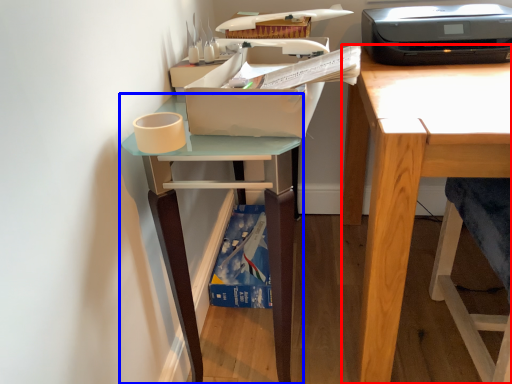
Question: Which of the following is the farthest to the observer, desk (highlighted by a red box) or table (highlighted by a blue box)?

Choices:
 (A) desk
 (B) table

Answer: (B)